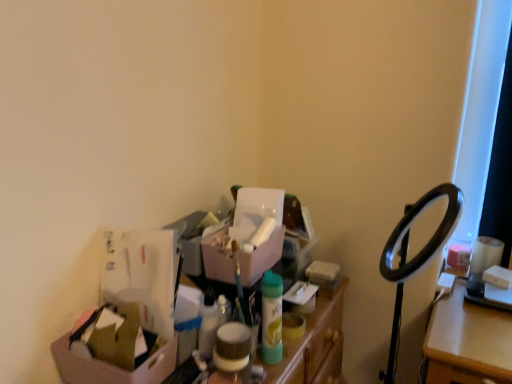
Question: In which direction should I rotate to look at matte pink box at center, which is counted as the first box, starting from the back?

Choices:
 (A) left
 (B) right

Answer: (A)

Question: Is matte pink box at center, the first box from the right, surrounding cardboard box at lower left, which is the second box in right-to-left order?

Choices:
 (A) no
 (B) yes

Answer: (A)

Question: From a real-world perspective, is matte pink box at center, the second box when ordered from front to back, on cardboard box at lower left, placed as the 2th box when sorted from top to bottom?

Choices:
 (A) yes
 (B) no

Answer: (A)

Question: Is matte pink box at center, positioned as the second box in left-to-right order, with cardboard box at lower left, placed as the 2th box when sorted from back to front?

Choices:
 (A) no
 (B) yes

Answer: (A)

Question: Can you confirm if matte pink box at center, positioned as the first box in top-to-bottom order, is bigger than cardboard box at lower left, placed as the 2th box when sorted from top to bottom?

Choices:
 (A) no
 (B) yes

Answer: (B)

Question: From the image's perspective, is matte pink box at center, positioned as the first box in top-to-bottom order, over cardboard box at lower left, placed as the 2th box when sorted from back to front?

Choices:
 (A) no
 (B) yes

Answer: (B)

Question: Is matte pink box at center, the first box from the right, positioned beyond the bounds of cardboard box at lower left, the 1th box when ordered from front to back?

Choices:
 (A) yes
 (B) no

Answer: (A)

Question: Does cardboard box at lower left, acting as the 1th box starting from the left, appear on the left side of matte pink box at center, the first box from the right?

Choices:
 (A) no
 (B) yes

Answer: (B)

Question: Does cardboard box at lower left, placed as the 2th box when sorted from back to front, have a lesser width compared to matte pink box at center, positioned as the second box in left-to-right order?

Choices:
 (A) yes
 (B) no

Answer: (B)

Question: Is cardboard box at lower left, acting as the 1th box starting from the left, smaller than matte pink box at center, which ranks as the 2th box in bottom-to-top order?

Choices:
 (A) no
 (B) yes

Answer: (B)

Question: Is cardboard box at lower left, placed as the 2th box when sorted from top to bottom, positioned with its back to matte pink box at center, the first box from the right?

Choices:
 (A) no
 (B) yes

Answer: (A)

Question: Is cardboard box at lower left, which is the second box in right-to-left order, at the right side of matte pink box at center, which ranks as the 2th box in bottom-to-top order?

Choices:
 (A) no
 (B) yes

Answer: (A)

Question: Is cardboard box at lower left, placed as the 2th box when sorted from top to bottom, aimed at matte pink box at center, the first box from the right?

Choices:
 (A) yes
 (B) no

Answer: (B)

Question: Is cardboard box at lower left, acting as the 1th box starting from the left, surrounding matte plastic storage bin at center?

Choices:
 (A) no
 (B) yes

Answer: (A)